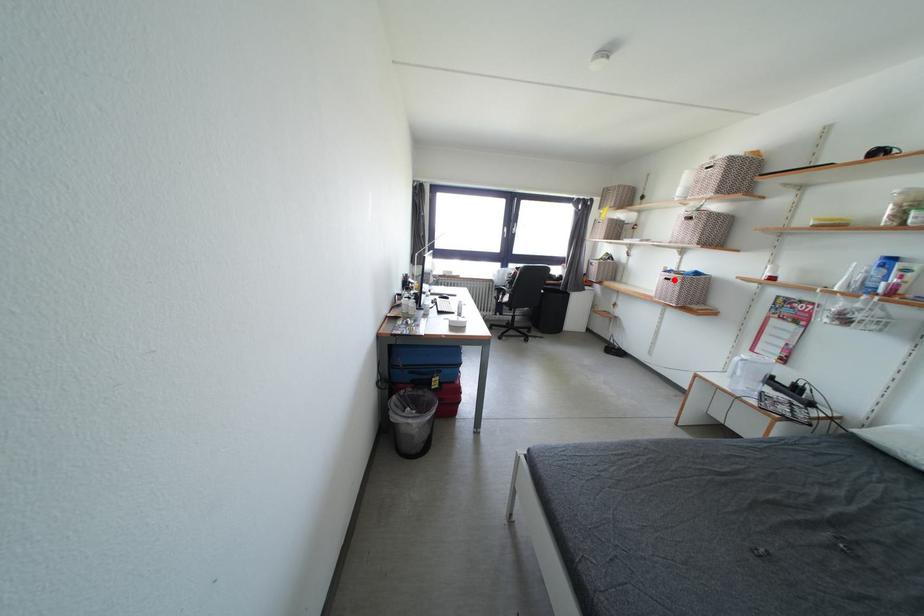
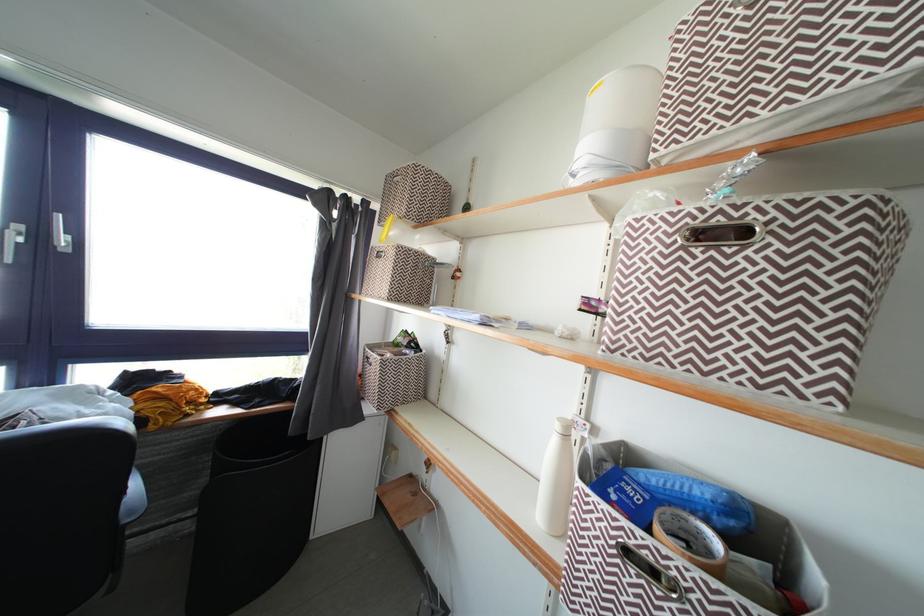
Locate, in the second image, the point that corresponds to the highlighted location in the first image.

(643, 541)